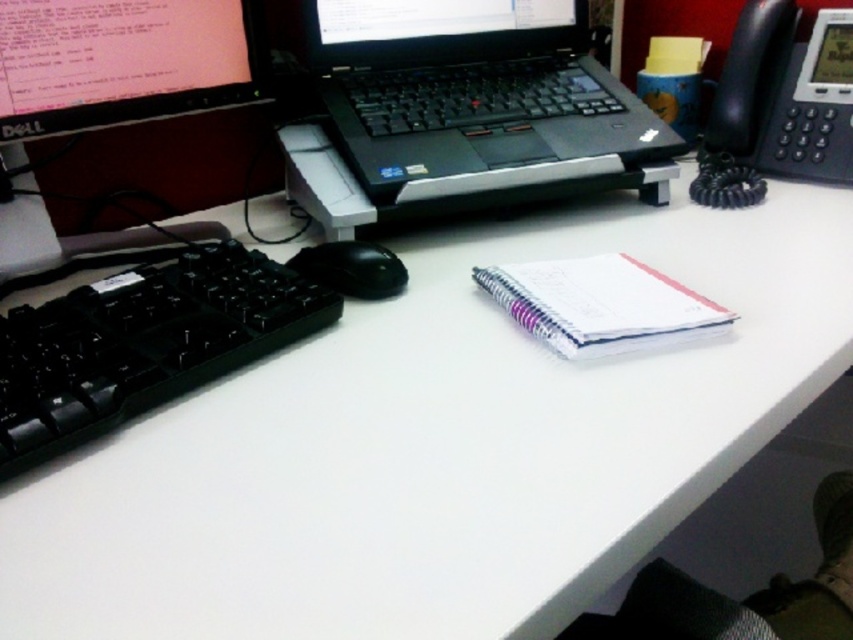
You are organizing your desk and want to move the white paper notebook at center closer to the Dell desktop computer monitor on the left. Is the black plastic keyboard at left currently blocking the path between the notebook and the monitor?

The black plastic keyboard at left is on the left side of the white paper notebook at center, so moving the notebook towards the Dell desktop computer monitor on the left would require moving the keyboard first to clear the path.

You are organizing your desk and want to place a new item between the black plastic laptop at center and the black matte mouse at left. However, the space between them is only 10 cm. If the mouse is 5 cm wide and the laptop is twice as wide as the mouse, will the new item fit in the space?

The black plastic laptop at center is twice as wide as the black matte mouse at left, so the laptop is 10 cm wide. The space between them is 10 cm, which matches the width of the laptop. However, since the mouse is 5 cm wide, the total space required would be the sum of both widths. Wait, but the question says the space between them is 10 cm. Hmm, maybe I need to recalculate. Let me think again. If the laptop is twice the mouse width, then laptop is 10 cm. The space between them is 10 cm. The mouse is 5 cm,